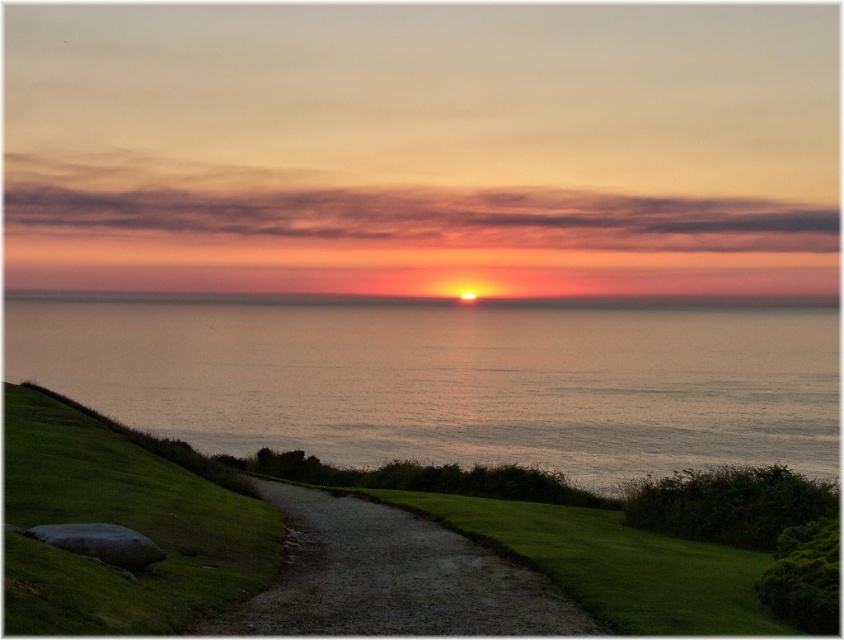
You are standing at the center of the image and want to walk towards the silvery water at center. According to the coordinates provided, in which direction should you move to reach it?

The silvery water at center is located at coordinates point (452, 381). Since you are already at the center of the image, you would need to move slightly towards the direction where the coordinates increase in the x and y axes to reach the silvery water at center.

You are standing at the point marked by the coordinates point (452, 381). Looking around, you see silvery water at center. Which direction would you face to see the silvery water at center?

You are already facing the silvery water at center since the point (452, 381) marks its location.